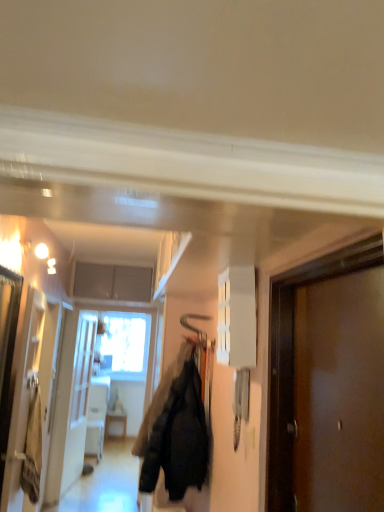
Question: Relative to brown matte door at right, is velvet black jacket at center in front or behind?

Choices:
 (A) behind
 (B) front

Answer: (A)

Question: Is velvet black jacket at center spatially inside brown matte door at right, or outside of it?

Choices:
 (A) inside
 (B) outside

Answer: (B)

Question: Which of these objects is positioned farthest from the white glossy cabinet at upper center?

Choices:
 (A) velvet black jacket at center
 (B) brown matte door at right

Answer: (A)

Question: Which of these objects is positioned farthest from the white glossy cabinet at upper center?

Choices:
 (A) velvet black jacket at center
 (B) brown matte door at right

Answer: (A)